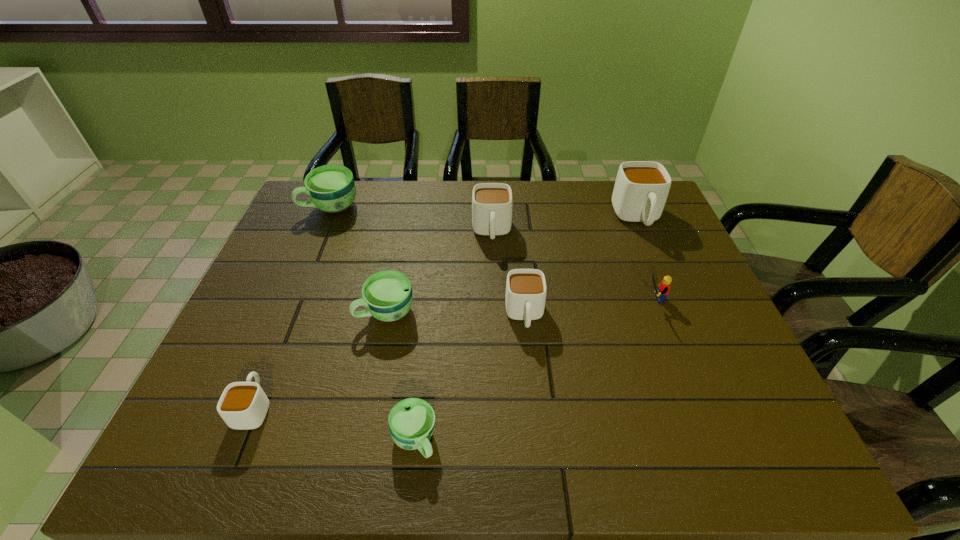
Identify the location of the tallest object. (641, 189).

Locate an element on the screen. The image size is (960, 540). the rightmost white cup is located at coordinates (641, 189).

Where is `the third smallest white cup`? The image size is (960, 540). the third smallest white cup is located at coordinates (491, 202).

Where is `the biggest blue cup`? Image resolution: width=960 pixels, height=540 pixels. the biggest blue cup is located at coordinates (331, 188).

Where is `the farthest blue cup`? The width and height of the screenshot is (960, 540). the farthest blue cup is located at coordinates (331, 188).

Where is `Lego`? The height and width of the screenshot is (540, 960). Lego is located at coordinates (664, 287).

The image size is (960, 540). I want to click on the third biggest white cup, so click(525, 297).

Where is `the second farthest blue cup`? the second farthest blue cup is located at coordinates (387, 294).

This screenshot has width=960, height=540. Identify the location of the smallest white cup. (243, 405).

Where is `the nearest white cup`? the nearest white cup is located at coordinates (243, 405).